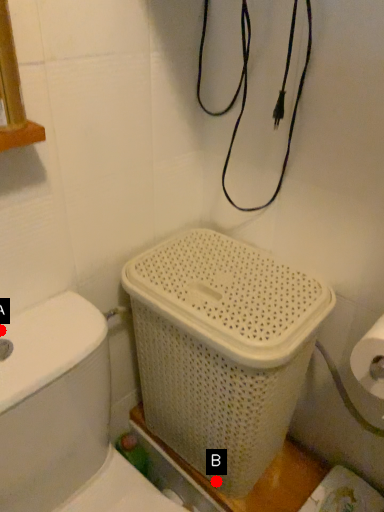
Question: Two points are circled on the image, labeled by A and B beside each circle. Which point is closer to the camera?

Choices:
 (A) A is closer
 (B) B is closer

Answer: (A)